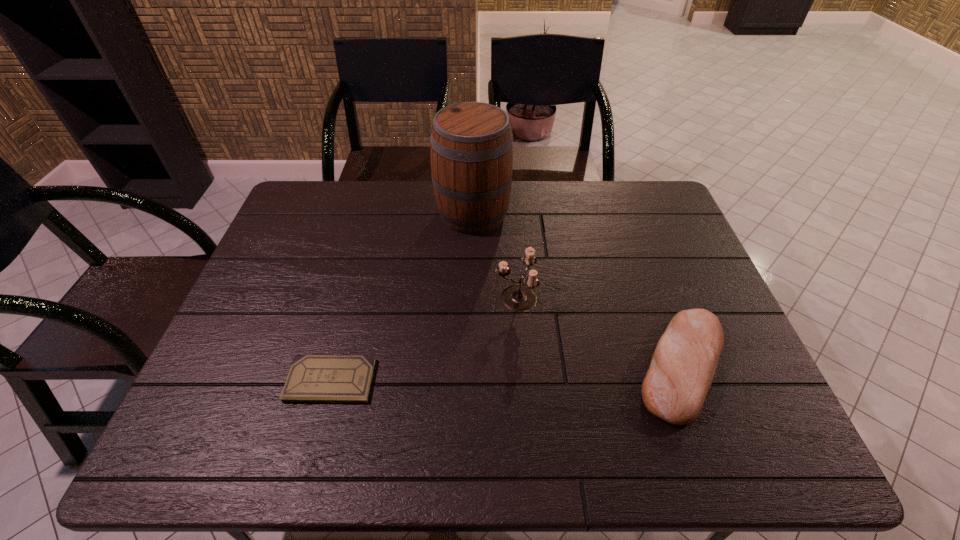
Where is `cider`? The width and height of the screenshot is (960, 540). cider is located at coordinates (471, 146).

The height and width of the screenshot is (540, 960). I want to click on the farthest object, so point(471,146).

The height and width of the screenshot is (540, 960). I want to click on the third nearest object, so click(520, 297).

What are the coordinates of `candle holder` in the screenshot? It's located at (520, 297).

Identify the location of bread. The height and width of the screenshot is (540, 960). (683, 365).

This screenshot has width=960, height=540. Identify the location of the second shortest object. (683, 365).

This screenshot has width=960, height=540. What are the coordinates of `the shortest object` in the screenshot? It's located at (312, 378).

At what (x,y) coordinates should I click in order to perform the action: click on the leftmost object. Please return your answer as a coordinate pair (x, y). Looking at the image, I should click on (312, 378).

Locate an element on the screen. The width and height of the screenshot is (960, 540). free space located 0.130m on the right of the farthest object is located at coordinates (550, 214).

Where is `free point located 0.280m on the left of the candle holder`? This screenshot has width=960, height=540. free point located 0.280m on the left of the candle holder is located at coordinates (390, 298).